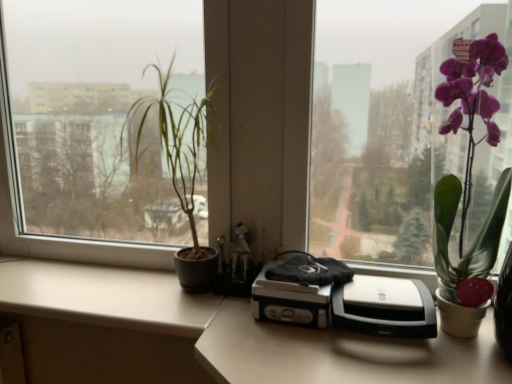
Question: From the image's perspective, does beige matte counter top at lower left appear higher than green matte plant at left, which is the second houseplant from right to left?

Choices:
 (A) no
 (B) yes

Answer: (A)

Question: From a real-world perspective, is beige matte counter top at lower left physically above green matte plant at left, which is the second houseplant from right to left?

Choices:
 (A) yes
 (B) no

Answer: (B)

Question: Is beige matte counter top at lower left in front of green matte plant at left, positioned as the 1th houseplant in left-to-right order?

Choices:
 (A) no
 (B) yes

Answer: (A)

Question: Can you confirm if beige matte counter top at lower left is bigger than green matte plant at left, positioned as the 1th houseplant in left-to-right order?

Choices:
 (A) no
 (B) yes

Answer: (A)

Question: Is beige matte counter top at lower left positioned with its back to green matte plant at left, positioned as the 1th houseplant in left-to-right order?

Choices:
 (A) yes
 (B) no

Answer: (B)

Question: Would you say beige matte counter top at lower left is a long distance from green matte plant at left, positioned as the 1th houseplant in left-to-right order?

Choices:
 (A) no
 (B) yes

Answer: (B)

Question: Is green matte plant at left, positioned as the 1th houseplant in left-to-right order, positioned before silver/black plastic printer at center?

Choices:
 (A) no
 (B) yes

Answer: (A)

Question: From a real-world perspective, is green matte plant at left, positioned as the 1th houseplant in left-to-right order, physically above silver/black plastic printer at center?

Choices:
 (A) no
 (B) yes

Answer: (B)

Question: Is green matte plant at left, which is the second houseplant from right to left, far from silver/black plastic printer at center?

Choices:
 (A) yes
 (B) no

Answer: (A)

Question: Is the depth of green matte plant at left, which is the second houseplant from right to left, greater than that of silver/black plastic printer at center?

Choices:
 (A) yes
 (B) no

Answer: (A)

Question: From the image's perspective, is green matte plant at left, positioned as the 1th houseplant in left-to-right order, above silver/black plastic printer at center?

Choices:
 (A) no
 (B) yes

Answer: (B)

Question: Is green matte plant at left, positioned as the 1th houseplant in left-to-right order, oriented towards silver/black plastic printer at center?

Choices:
 (A) yes
 (B) no

Answer: (B)

Question: Considering the relative sizes of silver/black plastic printer at center and beige matte counter top at lower left in the image provided, is silver/black plastic printer at center bigger than beige matte counter top at lower left?

Choices:
 (A) no
 (B) yes

Answer: (A)